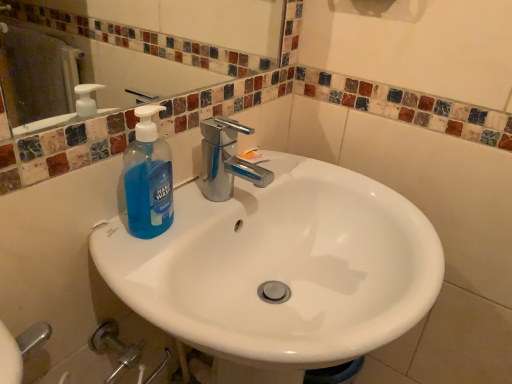
What is the approximate height of blue translucent hand wash at upper left?

7.88 inches.

What do you see at coordinates (147, 179) in the screenshot? The width and height of the screenshot is (512, 384). I see `blue translucent hand wash at upper left` at bounding box center [147, 179].

The height and width of the screenshot is (384, 512). Identify the location of blue translucent hand wash at upper left. click(147, 179).

What do you see at coordinates (280, 271) in the screenshot?
I see `white glossy sink at center` at bounding box center [280, 271].

Locate an element on the screen. This screenshot has height=384, width=512. white glossy sink at center is located at coordinates (280, 271).

I want to click on blue translucent hand wash at upper left, so click(x=147, y=179).

Would you say white glossy sink at center is to the left or to the right of blue translucent hand wash at upper left in the picture?

In the image, white glossy sink at center appears on the right side of blue translucent hand wash at upper left.

In the image, is white glossy sink at center positioned in front of or behind blue translucent hand wash at upper left?

Visually, white glossy sink at center is located in front of blue translucent hand wash at upper left.

Which point is more distant from viewer, (392, 283) or (155, 233)?

The point (392, 283) is farther.

From the image's perspective, is white glossy sink at center located above or below blue translucent hand wash at upper left?

white glossy sink at center is situated lower than blue translucent hand wash at upper left in the image.

From a real-world perspective, is white glossy sink at center on top of blue translucent hand wash at upper left?

No, from a real-world perspective, white glossy sink at center is not on top of blue translucent hand wash at upper left.

In terms of width, does white glossy sink at center look wider or thinner when compared to blue translucent hand wash at upper left?

white glossy sink at center is wider than blue translucent hand wash at upper left.

Between white glossy sink at center and blue translucent hand wash at upper left, which one has more height?

white glossy sink at center.

Who is smaller, white glossy sink at center or blue translucent hand wash at upper left?

With smaller size is blue translucent hand wash at upper left.

Is white glossy sink at center situated inside blue translucent hand wash at upper left or outside?

The correct answer is: outside.

Is white glossy sink at center positioned far away from blue translucent hand wash at upper left?

white glossy sink at center is actually quite close to blue translucent hand wash at upper left.

Could you tell me if white glossy sink at center is turned towards blue translucent hand wash at upper left?

No, white glossy sink at center is not aimed at blue translucent hand wash at upper left.

How many degrees apart are the facing directions of white glossy sink at center and blue translucent hand wash at upper left?

The angular difference between white glossy sink at center and blue translucent hand wash at upper left is 4.24 degrees.

I want to click on sink on the right of blue translucent hand wash at upper left, so click(x=280, y=271).

Considering the relative positions of blue translucent hand wash at upper left and white glossy sink at center in the image provided, is blue translucent hand wash at upper left to the left of white glossy sink at center from the viewer's perspective?

Indeed, blue translucent hand wash at upper left is positioned on the left side of white glossy sink at center.

Is blue translucent hand wash at upper left further to the viewer compared to white glossy sink at center?

Yes.

Is point (169, 161) positioned after point (122, 288)?

Yes, it is.

From the image's perspective, which one is positioned higher, blue translucent hand wash at upper left or white glossy sink at center?

blue translucent hand wash at upper left, from the image's perspective.

From a real-world perspective, is blue translucent hand wash at upper left physically located above or below white glossy sink at center?

blue translucent hand wash at upper left is above white glossy sink at center.

In terms of width, does blue translucent hand wash at upper left look wider or thinner when compared to white glossy sink at center?

blue translucent hand wash at upper left is thinner than white glossy sink at center.

Considering the sizes of objects blue translucent hand wash at upper left and white glossy sink at center in the image provided, who is shorter, blue translucent hand wash at upper left or white glossy sink at center?

blue translucent hand wash at upper left.

Based on their sizes in the image, would you say blue translucent hand wash at upper left is bigger or smaller than white glossy sink at center?

Clearly, blue translucent hand wash at upper left is smaller in size than white glossy sink at center.

Do you think blue translucent hand wash at upper left is within white glossy sink at center, or outside of it?

blue translucent hand wash at upper left is spatially positioned inside white glossy sink at center.

Is blue translucent hand wash at upper left far from white glossy sink at center?

blue translucent hand wash at upper left is near white glossy sink at center, not far away.

Could you tell me if blue translucent hand wash at upper left is turned towards white glossy sink at center?

Yes, blue translucent hand wash at upper left is facing white glossy sink at center.

What's the angular difference between blue translucent hand wash at upper left and white glossy sink at center's facing directions?

4.24 degrees.

Where is `sink located below the blue translucent hand wash at upper left (from the image's perspective)`? The width and height of the screenshot is (512, 384). sink located below the blue translucent hand wash at upper left (from the image's perspective) is located at coordinates (280, 271).

Where is `sink directly beneath the blue translucent hand wash at upper left (from a real-world perspective)`? The width and height of the screenshot is (512, 384). sink directly beneath the blue translucent hand wash at upper left (from a real-world perspective) is located at coordinates (280, 271).

Where is `sink to the right of blue translucent hand wash at upper left`? This screenshot has width=512, height=384. sink to the right of blue translucent hand wash at upper left is located at coordinates (280, 271).